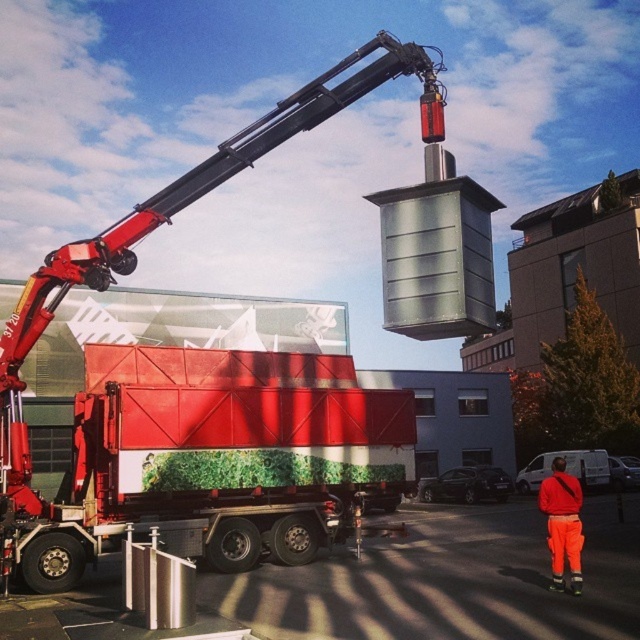
You are a delivery driver who needs to back up the red matte trailer truck at center to load the metallic cylindrical object. Can you safely back up without hitting the orange reflective pants at lower right?

The orange reflective pants at lower right is behind the red matte trailer truck at center, so backing up the red matte trailer truck at center might cause a collision with the orange reflective pants at lower right. Proceed with caution.

You are a delivery driver who needs to park your car between the red matte trailer truck at center and the orange reflective pants at lower right. Given that your car is 4 meters long, can you fit your car in the space between them?

The red matte trailer truck at center is larger in size than orange reflective pants at lower right, but the exact distance between them isn generated in the Objects Description. Without knowing the distance, it is impossible to determine if your car can fit.

You are a delivery driver who needs to park your red matte trailer truck at center in a specific parking spot located at coordinates 0.717, 0.322. Can you confirm if the truck is already parked correctly?

The red matte trailer truck at center is positioned exactly at point (x=205, y=458), so it is parked correctly in the designated spot.